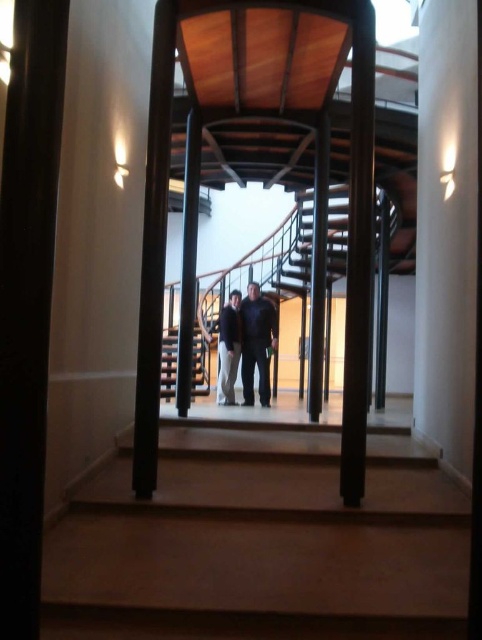
Between wooden stairs at center and dark blue jeans at center, which one has more height?

dark blue jeans at center

Can you confirm if wooden stairs at center is shorter than dark blue jeans at center?

Yes, wooden stairs at center is shorter than dark blue jeans at center.

Image resolution: width=482 pixels, height=640 pixels. What are the coordinates of `wooden stairs at center` in the screenshot? It's located at (262, 541).

Where is `wooden stairs at center`? This screenshot has width=482, height=640. wooden stairs at center is located at coordinates (262, 541).

Is wooden at center positioned at the back of dark blue jeans at center?

Yes, it is.

Does point (166, 340) come in front of point (227, 355)?

No, it is behind (227, 355).

This screenshot has height=640, width=482. Describe the element at coordinates (200, 364) in the screenshot. I see `wooden at center` at that location.

At what (x,y) coordinates should I click in order to perform the action: click on wooden at center. Please return your answer as a coordinate pair (x, y). Looking at the image, I should click on (200, 364).

Between dark blue fabric pants at center and dark blue jeans at center, which one has more height?

dark blue fabric pants at center

Is point (269, 337) more distant than point (231, 401)?

That is True.

Image resolution: width=482 pixels, height=640 pixels. I want to click on dark blue fabric pants at center, so click(256, 342).